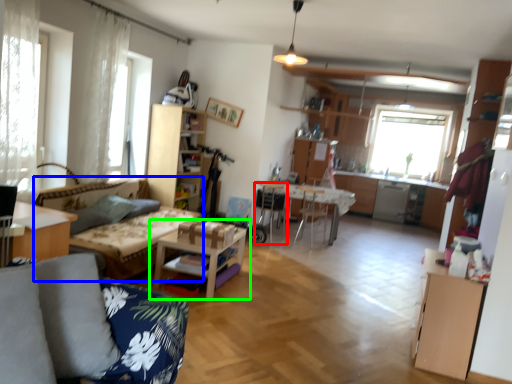
Question: Based on their relative distances, which object is nearer to armchair (highlighted by a red box)? Choose from couch (highlighted by a blue box) and table (highlighted by a green box).

Choices:
 (A) couch
 (B) table

Answer: (A)